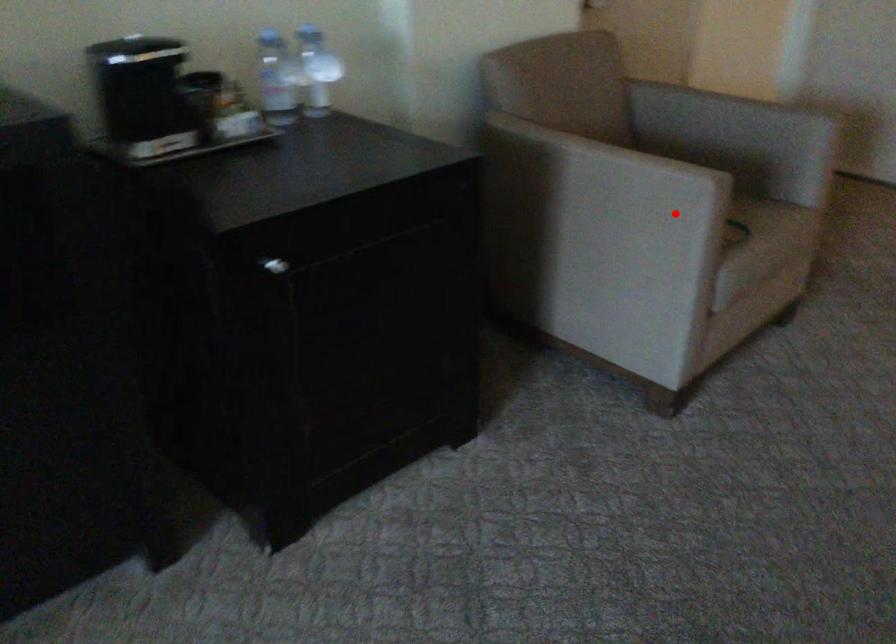
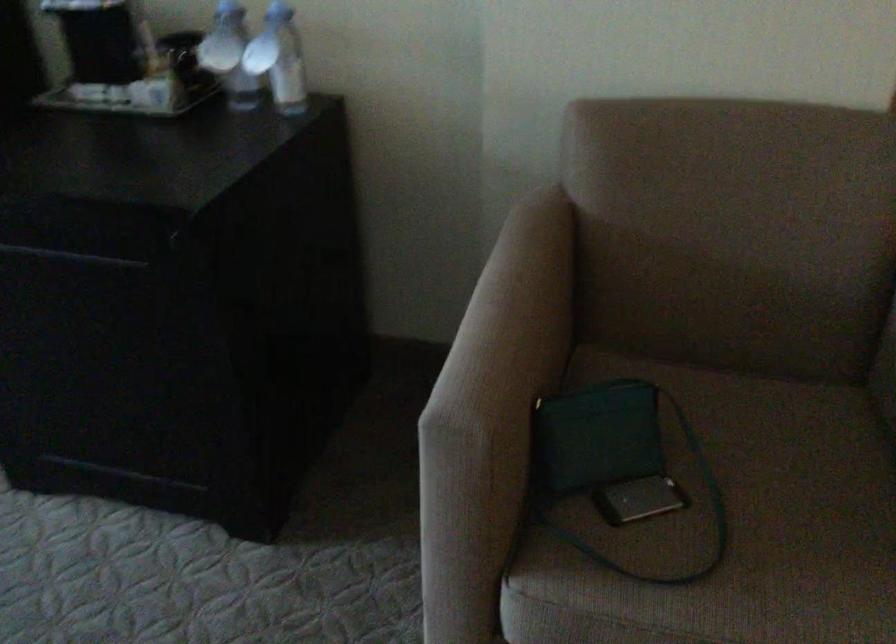
Find the pixel in the second image that matches the highlighted location in the first image.

(614, 464)